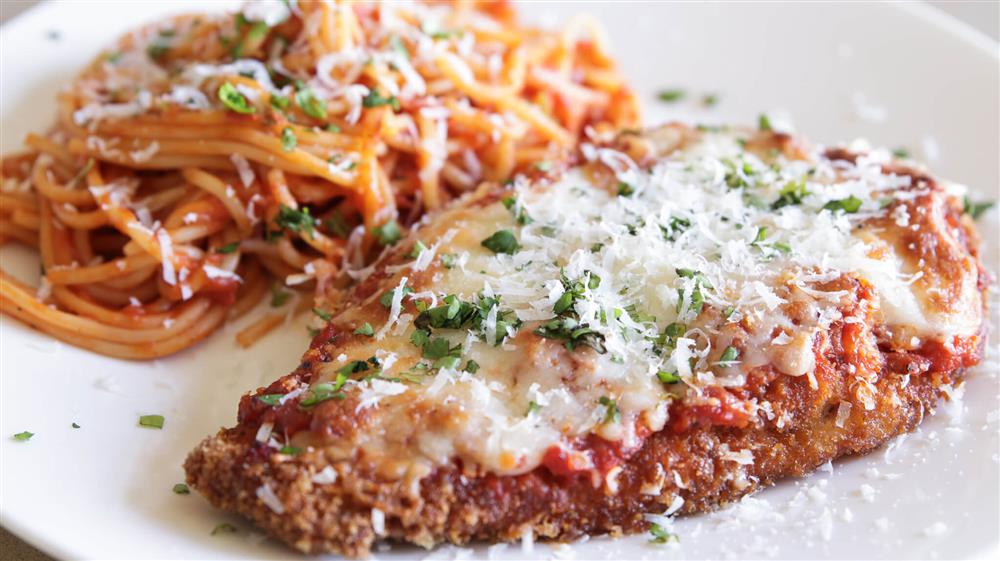
The width and height of the screenshot is (1000, 561). I want to click on plate, so click(x=977, y=538).